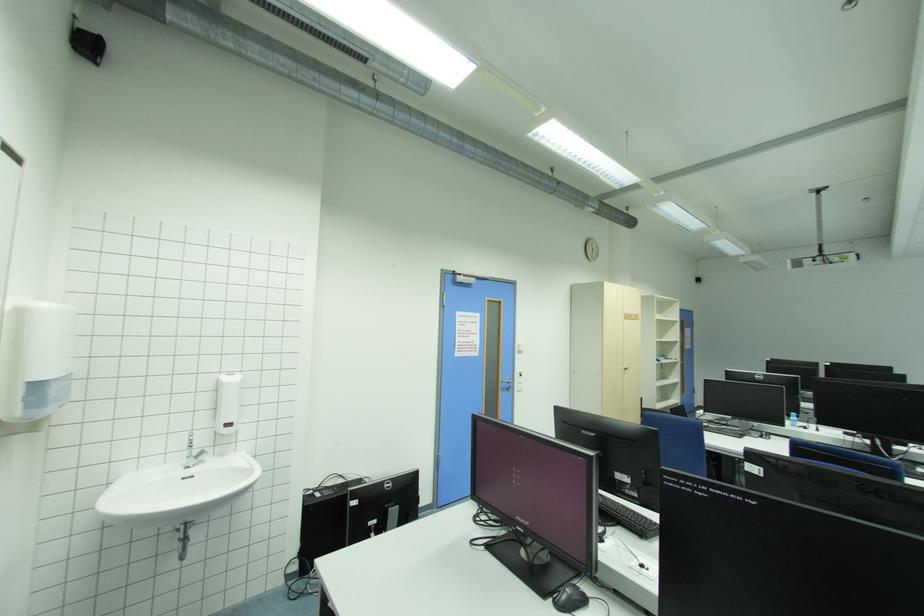
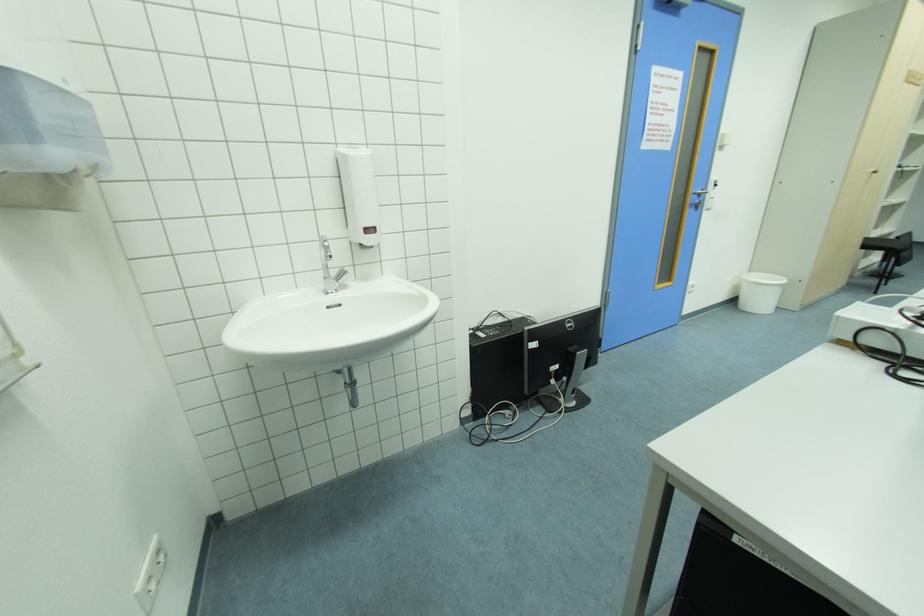
Where in the second image is the point corresponding to the point at 208,453 from the first image?

(347, 274)